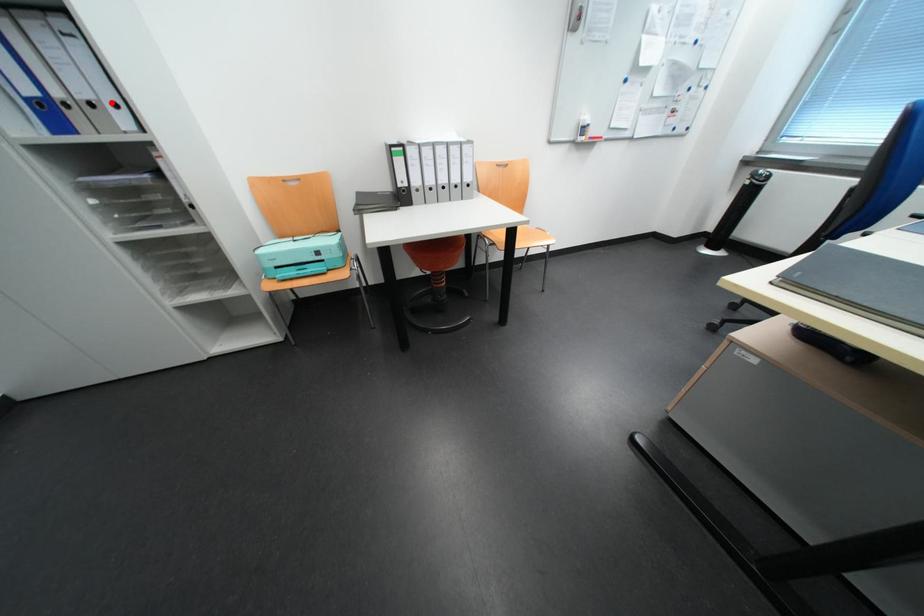
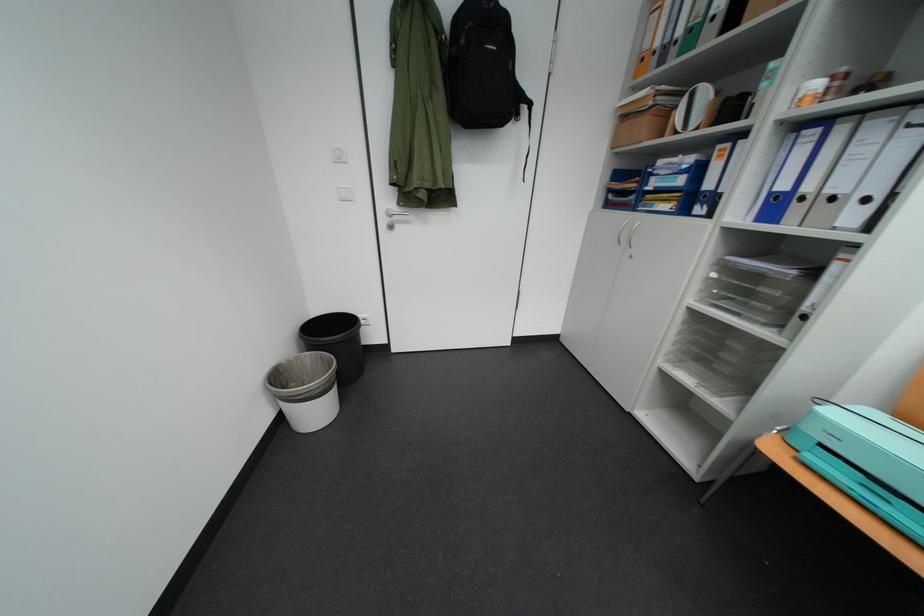
Question: I am providing you with two images of the same scene from different viewpoints. Image1 has a red point marked. In image2, the corresponding 3D location appears at what relative position? Reply with the corresponding letter.

Choices:
 (A) Closer
 (B) Farther

Answer: (A)